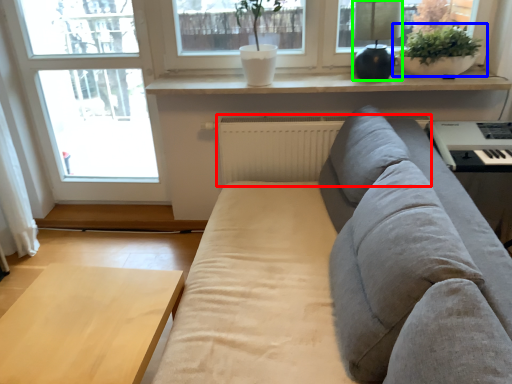
Question: Which is nearer to the radiator (highlighted by a red box)? houseplant (highlighted by a blue box) or lamp (highlighted by a green box).

Choices:
 (A) houseplant
 (B) lamp

Answer: (B)